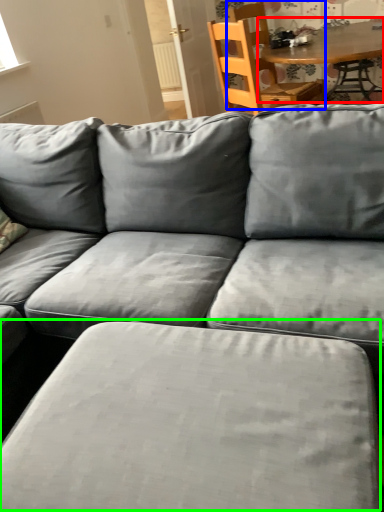
Question: Which object is positioned closest to table (highlighted by a red box)? Select from chair (highlighted by a blue box) and swivel chair (highlighted by a green box).

Choices:
 (A) chair
 (B) swivel chair

Answer: (A)